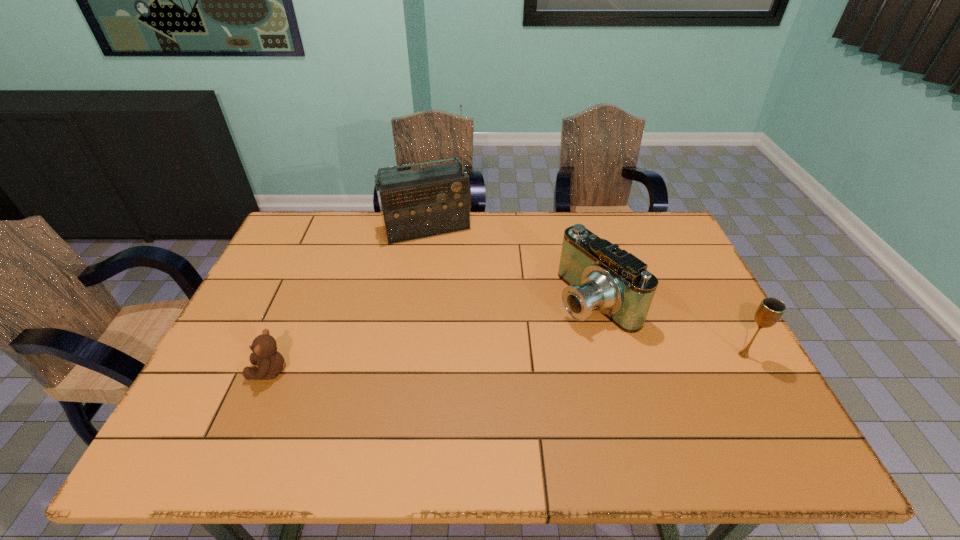
Image resolution: width=960 pixels, height=540 pixels. I want to click on vacant space on the desktop that is between the leftmost object and the rightmost object and is positioned on the front panel of the radio receiver, so click(x=482, y=364).

This screenshot has width=960, height=540. I want to click on free space on the desktop that is between the leftmost object and the rightmost object and is positioned on the front-facing side of the camcorder, so click(475, 364).